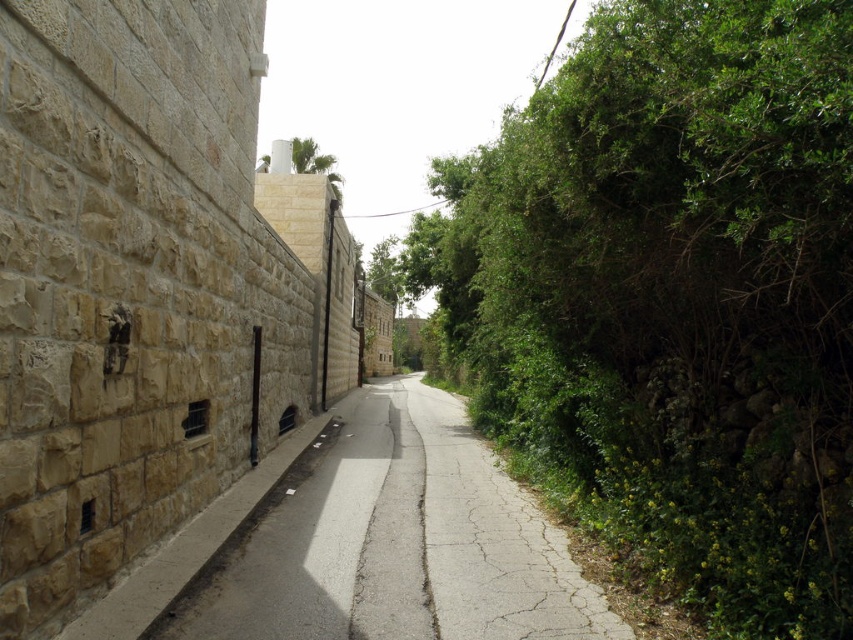
You are a delivery drone flying over a narrow alleyway. You need to land on the smooth concrete pavement at center. Considering the space available, will the green leafy tree at upper center interfere with your landing?

The smooth concrete pavement at center occupies less space than the green leafy tree at upper center, so the tree may block the landing area, making it difficult for the drone to land safely.

You are standing in the alleyway and want to take a photo of the green leafy bush at right. To ensure it is centered in your camera frame, where should you position yourself relative to the alleyway?

To center the green leafy bush at right in your camera frame, position yourself so that the bush is at the coordinates specified by the point 0.467 along the horizontal axis and 0.789 along the vertical axis of the alleyway.

You are a delivery drone flying over a narrow alleyway. You need to land on the smooth concrete pavement at center. However, there is a green leafy tree at upper center above it. Do you think the tree will block your landing?

The smooth concrete pavement at center is positioned under the green leafy tree at upper center, so the tree might block the drone from landing safely. Choose another spot or adjust your approach to avoid the tree branches.